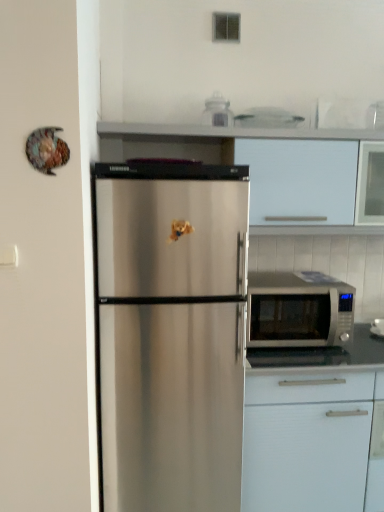
Question: From a real-world perspective, is white matte cabinet at upper center, the first cabinetry viewed from the top, located beneath white matte cabinet at lower right, the second cabinetry from the top?

Choices:
 (A) no
 (B) yes

Answer: (A)

Question: Is white matte cabinet at upper center, the first cabinetry viewed from the top, far away from white matte cabinet at lower right, acting as the 1th cabinetry starting from the bottom?

Choices:
 (A) yes
 (B) no

Answer: (B)

Question: Considering the relative positions of white matte cabinet at upper center, placed as the second cabinetry when sorted from bottom to top, and white matte cabinet at lower right, the second cabinetry from the top, in the image provided, is white matte cabinet at upper center, placed as the second cabinetry when sorted from bottom to top, behind white matte cabinet at lower right, the second cabinetry from the top,?

Choices:
 (A) no
 (B) yes

Answer: (B)

Question: Considering the relative sizes of white matte cabinet at upper center, the first cabinetry viewed from the top, and white matte cabinet at lower right, acting as the 1th cabinetry starting from the bottom, in the image provided, is white matte cabinet at upper center, the first cabinetry viewed from the top, thinner than white matte cabinet at lower right, acting as the 1th cabinetry starting from the bottom,?

Choices:
 (A) no
 (B) yes

Answer: (B)

Question: Is white matte cabinet at upper center, the first cabinetry viewed from the top, surrounding white matte cabinet at lower right, the second cabinetry from the top?

Choices:
 (A) yes
 (B) no

Answer: (B)

Question: From the image's perspective, does white matte cabinet at upper center, placed as the second cabinetry when sorted from bottom to top, appear lower than white matte cabinet at lower right, acting as the 1th cabinetry starting from the bottom?

Choices:
 (A) yes
 (B) no

Answer: (B)

Question: Is white matte cabinet at upper center, placed as the second cabinetry when sorted from bottom to top, with silver metallic microwave at right?

Choices:
 (A) yes
 (B) no

Answer: (B)

Question: From the image's perspective, is white matte cabinet at upper center, the first cabinetry viewed from the top, below silver metallic microwave at right?

Choices:
 (A) no
 (B) yes

Answer: (A)

Question: Is white matte cabinet at upper center, the first cabinetry viewed from the top, smaller than silver metallic microwave at right?

Choices:
 (A) no
 (B) yes

Answer: (A)

Question: Is white matte cabinet at upper center, placed as the second cabinetry when sorted from bottom to top, taller than silver metallic microwave at right?

Choices:
 (A) yes
 (B) no

Answer: (A)

Question: Considering the relative positions of white matte cabinet at upper center, the first cabinetry viewed from the top, and silver metallic microwave at right in the image provided, is white matte cabinet at upper center, the first cabinetry viewed from the top, to the left of silver metallic microwave at right from the viewer's perspective?

Choices:
 (A) yes
 (B) no

Answer: (A)

Question: Considering the relative positions of white matte cabinet at upper center, placed as the second cabinetry when sorted from bottom to top, and silver metallic microwave at right in the image provided, is white matte cabinet at upper center, placed as the second cabinetry when sorted from bottom to top, behind silver metallic microwave at right?

Choices:
 (A) yes
 (B) no

Answer: (B)

Question: Is white matte cabinet at lower right, the second cabinetry from the top, located within silver metallic microwave at right?

Choices:
 (A) yes
 (B) no

Answer: (B)